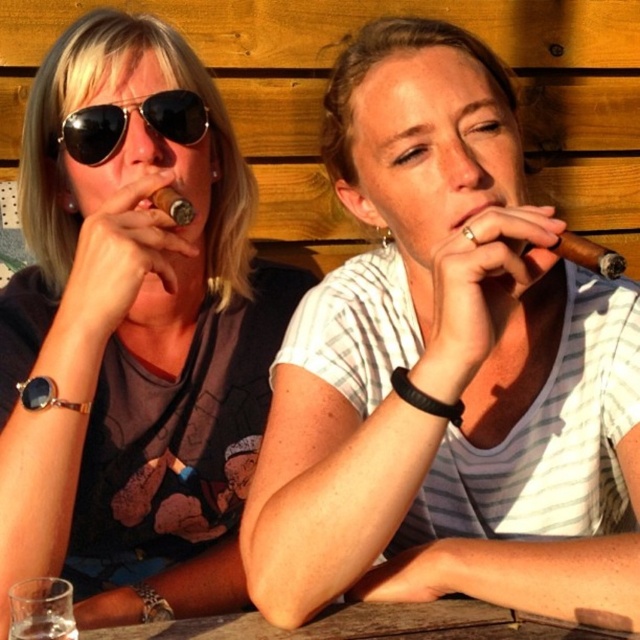
Based on the photo, between matte brown cigar at center and matte black cigar at center, which one appears on the right side from the viewer's perspective?

Positioned to the right is matte brown cigar at center.

Can you confirm if matte brown cigar at center is positioned below matte black cigar at center?

Correct, matte brown cigar at center is located below matte black cigar at center.

Does point (280, 616) lie in front of point (161, 97)?

Yes.

I want to click on matte brown cigar at center, so click(x=442, y=368).

Between matte brown cigar at center and black aviator sunglasses at upper left, which one appears on the left side from the viewer's perspective?

From the viewer's perspective, black aviator sunglasses at upper left appears more on the left side.

You are a GUI agent. You are given a task and a screenshot of the screen. Output one action in this format:
    pyautogui.click(x=<x>, y=<y>)
    Task: Click on the matte brown cigar at center
    The width and height of the screenshot is (640, 640).
    Given the screenshot: What is the action you would take?
    pyautogui.click(x=442, y=368)

Which of these two, matte black cigar at center or wooden table at lower center, stands taller?

matte black cigar at center

Can you confirm if matte black cigar at center is taller than wooden table at lower center?

Indeed, matte black cigar at center has a greater height compared to wooden table at lower center.

Is point (28, 193) closer to camera compared to point (161, 634)?

No, (28, 193) is further to viewer.

You are a GUI agent. You are given a task and a screenshot of the screen. Output one action in this format:
    pyautogui.click(x=<x>, y=<y>)
    Task: Click on the matte black cigar at center
    
    Given the screenshot: What is the action you would take?
    pyautogui.click(x=132, y=333)